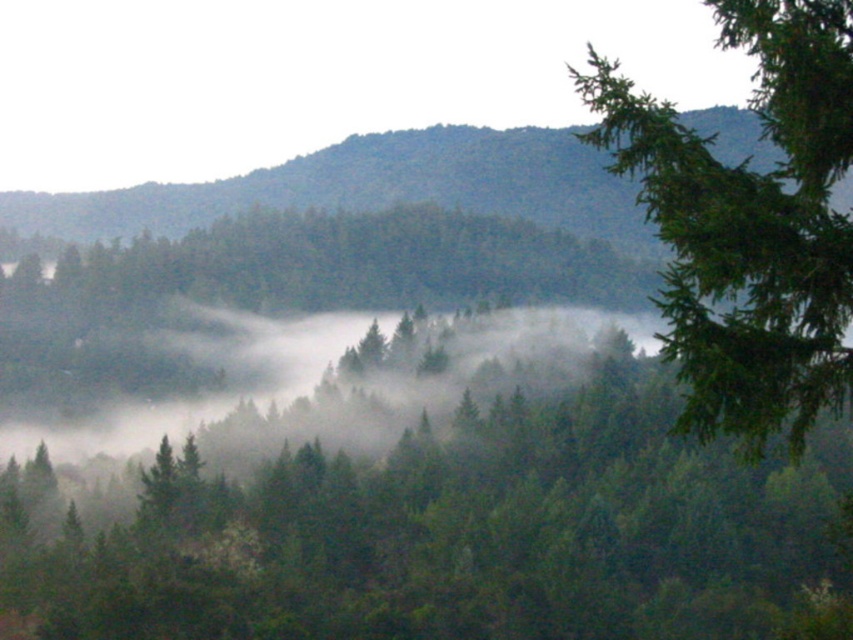
Question: Is green matte tree at center wider than green needle-like at upper right?

Choices:
 (A) no
 (B) yes

Answer: (B)

Question: Which point is farther to the camera?

Choices:
 (A) green matte hillside at upper center
 (B) green matte tree at center

Answer: (A)

Question: Which of the following is the closest to the observer?

Choices:
 (A) (827, 300)
 (B) (766, 472)

Answer: (A)

Question: Does green matte tree at center come in front of green matte hillside at upper center?

Choices:
 (A) yes
 (B) no

Answer: (A)

Question: Which point is farther from the camera taking this photo?

Choices:
 (A) (346, 208)
 (B) (340, 452)

Answer: (A)

Question: Is green matte tree at center above green needle-like at upper right?

Choices:
 (A) no
 (B) yes

Answer: (A)